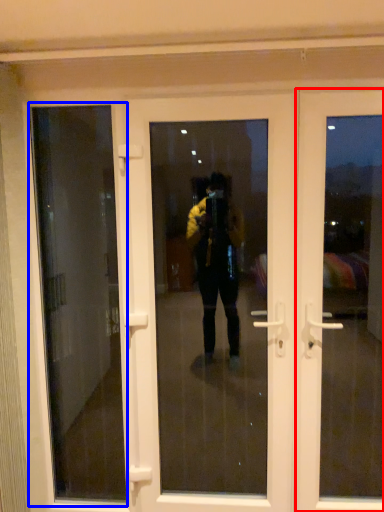
Question: Which object is closer to the camera taking this photo, door (highlighted by a red box) or window screen (highlighted by a blue box)?

Choices:
 (A) door
 (B) window screen

Answer: (A)